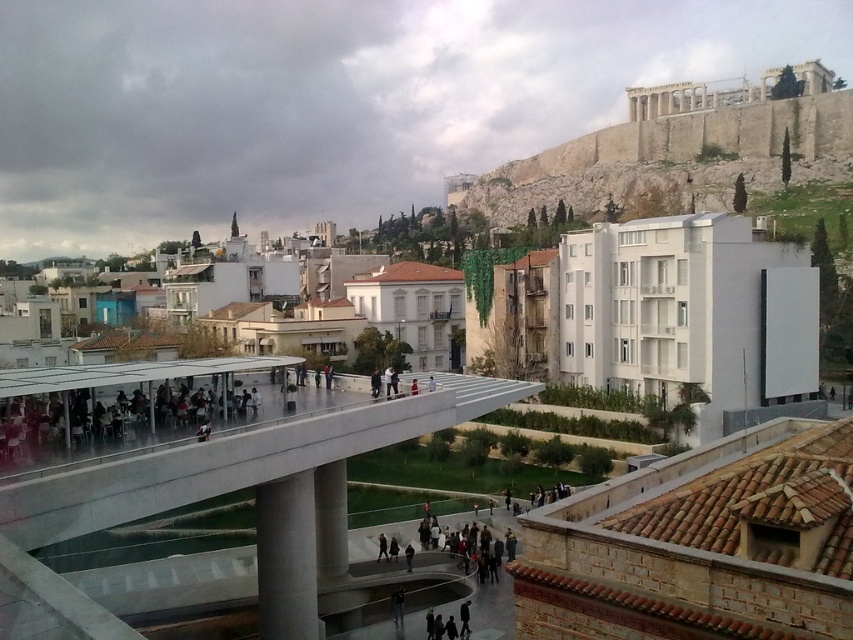
Question: Among these objects, which one is farthest from the camera?

Choices:
 (A) white concrete overpass at center
 (B) white concrete pillar at center
 (C) gray concrete pillar at center

Answer: (B)

Question: Among these objects, which one is nearest to the camera?

Choices:
 (A) white concrete overpass at center
 (B) white concrete pillar at center
 (C) gray concrete pillar at center

Answer: (A)

Question: Does gray concrete pillar at center appear under white concrete pillar at center?

Choices:
 (A) yes
 (B) no

Answer: (A)

Question: Is gray concrete pillar at center smaller than white concrete pillar at center?

Choices:
 (A) yes
 (B) no

Answer: (A)

Question: Which point is farther from the camera taking this photo?

Choices:
 (A) (325, 540)
 (B) (264, 456)
 (C) (293, 612)

Answer: (A)

Question: Can you confirm if gray concrete pillar at center is bigger than white concrete pillar at center?

Choices:
 (A) yes
 (B) no

Answer: (B)